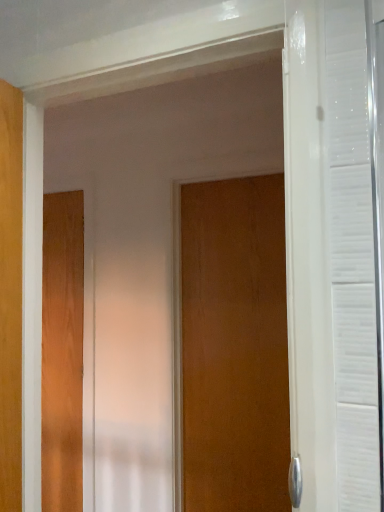
Measure the distance between point (65,218) and camera.

They are 7.47 feet apart.

Describe the element at coordinates (62, 351) in the screenshot. I see `wooden door at left, acting as the 2th door starting from the front` at that location.

Find the location of a particular element. The height and width of the screenshot is (512, 384). wooden door at left, acting as the 2th door starting from the front is located at coordinates (62, 351).

What is the approximate width of wooden door at center, positioned as the 2th door in back-to-front order?

The width of wooden door at center, positioned as the 2th door in back-to-front order, is 7.43 centimeters.

Locate an element on the screen. The image size is (384, 512). wooden door at center, marked as the 1th door in a right-to-left arrangement is located at coordinates click(234, 346).

What do you see at coordinates (234, 346) in the screenshot? I see `wooden door at center, marked as the 1th door in a right-to-left arrangement` at bounding box center [234, 346].

The image size is (384, 512). In order to click on wooden door at left, which appears as the first door when viewed from the back in this screenshot , I will do `click(62, 351)`.

Visually, is wooden door at left, the first door viewed from the left, positioned to the left or to the right of wooden door at center, positioned as the second door in left-to-right order?

Based on their positions, wooden door at left, the first door viewed from the left, is located to the left of wooden door at center, positioned as the second door in left-to-right order.

Is wooden door at left, acting as the 2th door starting from the front, positioned behind wooden door at center, positioned as the second door in left-to-right order?

Yes, it is.

Does point (47, 356) come farther from viewer compared to point (213, 239)?

That is True.

From the image's perspective, is wooden door at left, which appears as the first door when viewed from the back, positioned above or below wooden door at center, marked as the 1th door in a right-to-left arrangement?

From the image's perspective, wooden door at left, which appears as the first door when viewed from the back, appears below wooden door at center, marked as the 1th door in a right-to-left arrangement.

From a real-world perspective, who is located higher, wooden door at left, acting as the 2th door starting from the front, or wooden door at center, arranged as the 1th door when viewed from the front?

wooden door at center, arranged as the 1th door when viewed from the front.

Can you confirm if wooden door at left, the first door viewed from the left, is wider than wooden door at center, positioned as the 2th door in back-to-front order?

No.

Who is shorter, wooden door at left, acting as the 2th door starting from the front, or wooden door at center, marked as the 1th door in a right-to-left arrangement?

wooden door at center, marked as the 1th door in a right-to-left arrangement, is shorter.

Can you confirm if wooden door at left, the second door when ordered from right to left, is smaller than wooden door at center, marked as the 1th door in a right-to-left arrangement?

Correct, wooden door at left, the second door when ordered from right to left, occupies less space than wooden door at center, marked as the 1th door in a right-to-left arrangement.

Is wooden door at left, the first door viewed from the left, surrounding wooden door at center, positioned as the second door in left-to-right order?

No, wooden door at center, positioned as the second door in left-to-right order, is not surrounded by wooden door at left, the first door viewed from the left.

Are wooden door at left, the second door when ordered from right to left, and wooden door at center, arranged as the 1th door when viewed from the front, making contact?

No, wooden door at left, the second door when ordered from right to left, is not touching wooden door at center, arranged as the 1th door when viewed from the front.

Is wooden door at left, acting as the 2th door starting from the front, looking in the opposite direction of wooden door at center, positioned as the 2th door in back-to-front order?

wooden door at left, acting as the 2th door starting from the front, is not turned away from wooden door at center, positioned as the 2th door in back-to-front order.

Can you tell me how much wooden door at left, acting as the 2th door starting from the front, and wooden door at center, arranged as the 1th door when viewed from the front, differ in facing direction?

0.000233 degrees separate the facing orientations of wooden door at left, acting as the 2th door starting from the front, and wooden door at center, arranged as the 1th door when viewed from the front.

How distant is wooden door at left, acting as the 2th door starting from the front, from wooden door at center, arranged as the 1th door when viewed from the front?

They are 76.65 centimeters apart.

The height and width of the screenshot is (512, 384). I want to click on door behind the wooden door at center, positioned as the second door in left-to-right order, so click(62, 351).

Which object is positioned more to the left, wooden door at center, arranged as the 1th door when viewed from the front, or wooden door at left, which appears as the first door when viewed from the back?

wooden door at left, which appears as the first door when viewed from the back, is more to the left.

Does wooden door at center, positioned as the second door in left-to-right order, lie in front of wooden door at left, the second door when ordered from right to left?

That is True.

Between point (239, 234) and point (80, 337), which one is positioned behind?

The point (80, 337) is more distant.

From the image's perspective, is wooden door at center, arranged as the 1th door when viewed from the front, beneath wooden door at left, which appears as the first door when viewed from the back?

Actually, wooden door at center, arranged as the 1th door when viewed from the front, appears above wooden door at left, which appears as the first door when viewed from the back, in the image.

From a real-world perspective, who is located higher, wooden door at center, arranged as the 1th door when viewed from the front, or wooden door at left, which appears as the first door when viewed from the back?

From a 3D spatial view, wooden door at center, arranged as the 1th door when viewed from the front, is above.

Which of these two, wooden door at center, marked as the 1th door in a right-to-left arrangement, or wooden door at left, the second door when ordered from right to left, is thinner?

wooden door at left, the second door when ordered from right to left, is thinner.

Who is shorter, wooden door at center, marked as the 1th door in a right-to-left arrangement, or wooden door at left, the first door viewed from the left?

Standing shorter between the two is wooden door at center, marked as the 1th door in a right-to-left arrangement.

Based on their sizes in the image, would you say wooden door at center, arranged as the 1th door when viewed from the front, is bigger or smaller than wooden door at left, which appears as the first door when viewed from the back?

Considering their sizes, wooden door at center, arranged as the 1th door when viewed from the front, takes up more space than wooden door at left, which appears as the first door when viewed from the back.

Is wooden door at center, marked as the 1th door in a right-to-left arrangement, inside or outside of wooden door at left, the second door when ordered from right to left?

wooden door at center, marked as the 1th door in a right-to-left arrangement, is located beyond the bounds of wooden door at left, the second door when ordered from right to left.

Are wooden door at center, positioned as the 2th door in back-to-front order, and wooden door at left, the second door when ordered from right to left, located far from each other?

wooden door at center, positioned as the 2th door in back-to-front order, is near wooden door at left, the second door when ordered from right to left, not far away.

Consider the image. Is wooden door at center, positioned as the 2th door in back-to-front order, positioned with its back to wooden door at left, the second door when ordered from right to left?

No, wooden door at left, the second door when ordered from right to left, is not at the back of wooden door at center, positioned as the 2th door in back-to-front order.

Where is `door in front of the wooden door at left, the second door when ordered from right to left`? The height and width of the screenshot is (512, 384). door in front of the wooden door at left, the second door when ordered from right to left is located at coordinates (234, 346).

The height and width of the screenshot is (512, 384). In the image, there is a wooden door at center, marked as the 1th door in a right-to-left arrangement. What are the coordinates of `door below it (from a real-world perspective)` in the screenshot? It's located at (62, 351).

Find the location of a particular element. door lying behind the wooden door at center, positioned as the 2th door in back-to-front order is located at coordinates (62, 351).